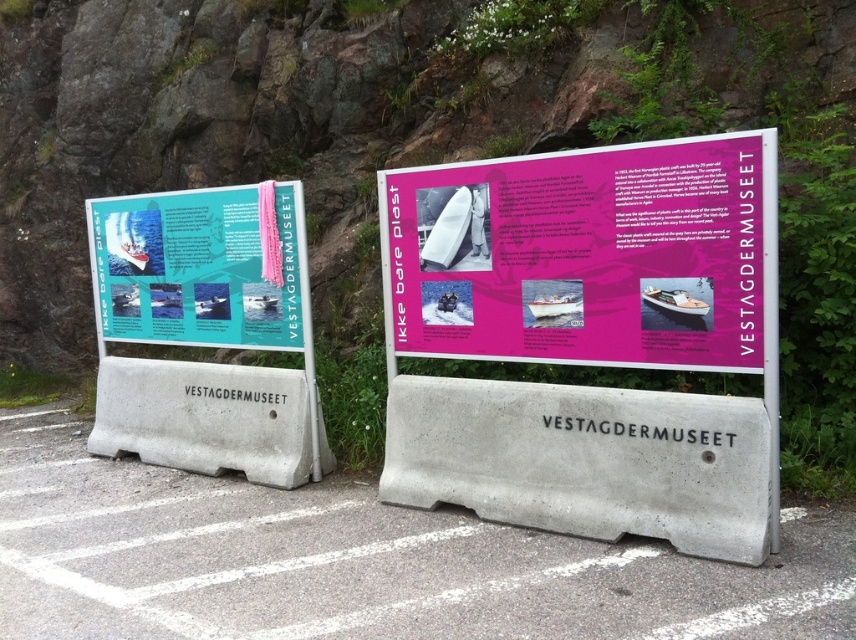
Who is lower down, pink paperboard poster at center or teal paper poster at center left?

pink paperboard poster at center is lower down.

At what (x,y) coordinates should I click in order to perform the action: click on pink paperboard poster at center. Please return your answer as a coordinate pair (x, y). Image resolution: width=856 pixels, height=640 pixels. Looking at the image, I should click on (583, 256).

In the scene shown: Is concrete at center smaller than pink paperboard poster at center?

No.

The height and width of the screenshot is (640, 856). I want to click on concrete at center, so click(360, 563).

Who is more distant from viewer, [663,609] or [652,202]?

Positioned behind is point [652,202].

Identify the location of concrete at center. This screenshot has width=856, height=640. pyautogui.click(x=360, y=563).

Does concrete at center have a greater width compared to teal paper poster at center left?

Yes.

Who is more distant from viewer, (x=197, y=493) or (x=159, y=209)?

The point (x=159, y=209) is more distant.

Between point (804, 563) and point (271, 252), which one is positioned behind?

The point (271, 252) is behind.

This screenshot has width=856, height=640. I want to click on concrete at center, so click(360, 563).